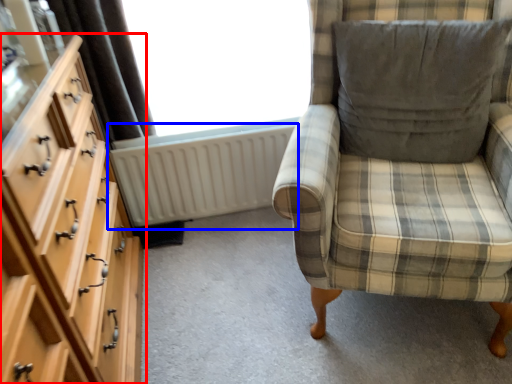
Question: Among these objects, which one is farthest to the camera, chest of drawers (highlighted by a red box) or radiator (highlighted by a blue box)?

Choices:
 (A) chest of drawers
 (B) radiator

Answer: (B)